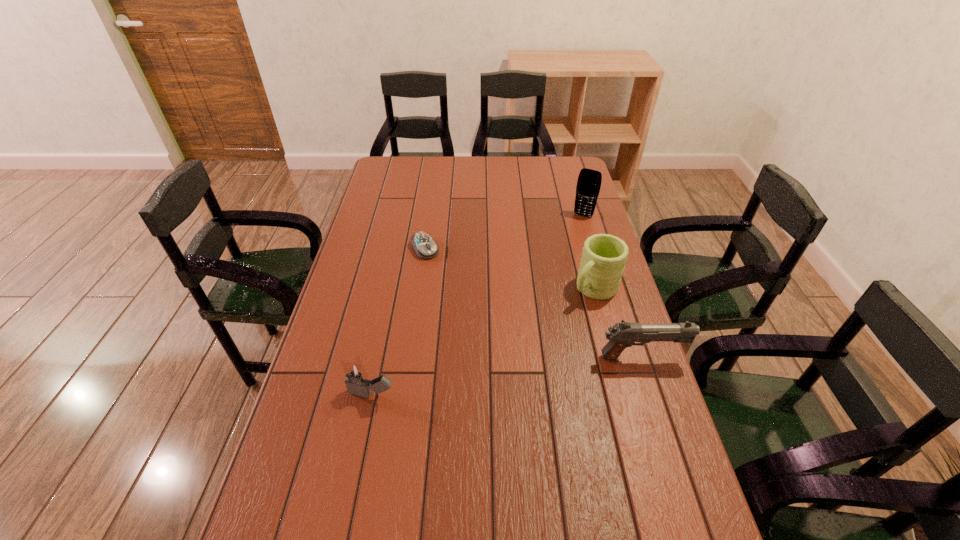
Image resolution: width=960 pixels, height=540 pixels. Find the location of `vacant space located on the wheel side of the second farthest object`. vacant space located on the wheel side of the second farthest object is located at coordinates (443, 276).

This screenshot has height=540, width=960. I want to click on vacant region located 0.250m on the side of the third nearest object with the handle, so click(x=531, y=348).

Find the location of a particular element. The height and width of the screenshot is (540, 960). free region located on the side of the third nearest object with the handle is located at coordinates pos(516,361).

At what (x,y) coordinates should I click in order to perform the action: click on free space located on the side of the third nearest object with the handle. Please return your answer as a coordinate pair (x, y). The image size is (960, 540). Looking at the image, I should click on (552, 329).

Image resolution: width=960 pixels, height=540 pixels. What are the coordinates of `vacant space situated 0.350m on the screen of the tallest object` in the screenshot? It's located at (550, 274).

Locate an element on the screen. The image size is (960, 540). free space located on the screen of the tallest object is located at coordinates coord(559,257).

Locate an element on the screen. The height and width of the screenshot is (540, 960). vacant space located 0.180m on the screen of the tallest object is located at coordinates (565, 246).

I want to click on object that is at the left edge, so click(357, 383).

At what (x,y) coordinates should I click in order to perform the action: click on gun present at the right edge. Please return your answer as a coordinate pair (x, y). The height and width of the screenshot is (540, 960). Looking at the image, I should click on 622,335.

Locate an element on the screen. mug present at the right edge is located at coordinates (604, 256).